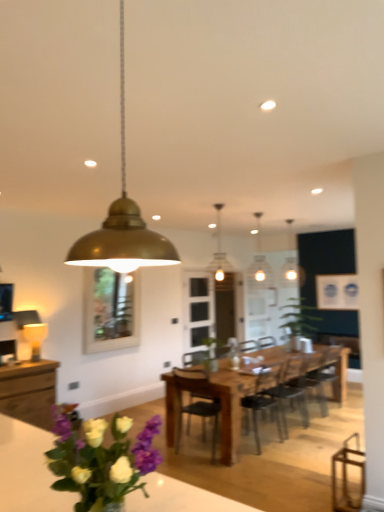
Where is `free space in front of wooden chair at center, positioned as the 5th chair in right-to-left order`? This screenshot has width=384, height=512. free space in front of wooden chair at center, positioned as the 5th chair in right-to-left order is located at coordinates (216, 474).